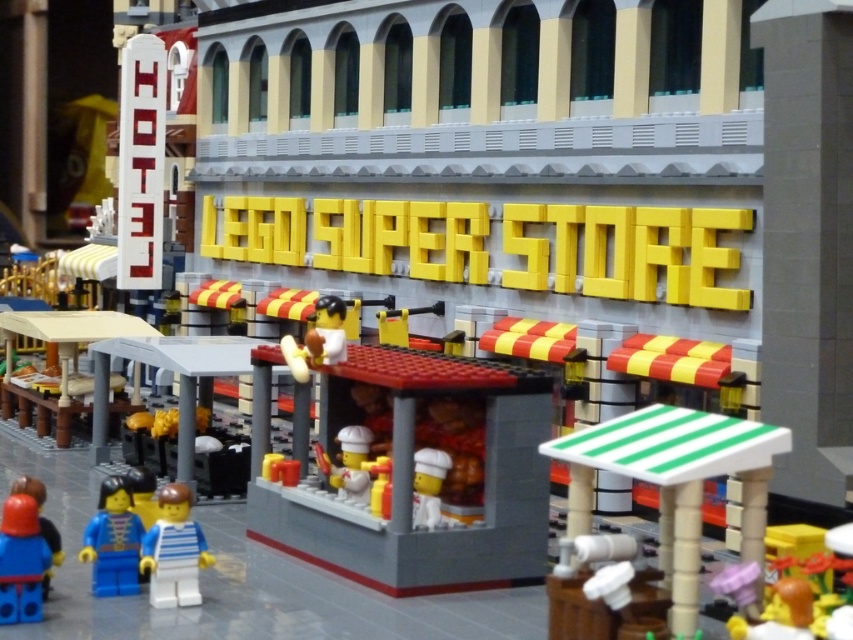
You are standing in front of the LEGO SUPERSTORE and want to place a new Lego figure exactly halfway between the two points marked as point 1 at point (167,550) and point 2 at point (93,576). Which direction should you move from the midpoint to ensure the figure is closer to the LEGO SUPERSTORE?

The midpoint between point 1 at (167,550) and point 2 at (93,576) is at the average of their coordinates. Since point 1 is closer to the viewer than point 2, moving towards point 1 from the midpoint will place the figure closer to the LEGO SUPERSTORE.